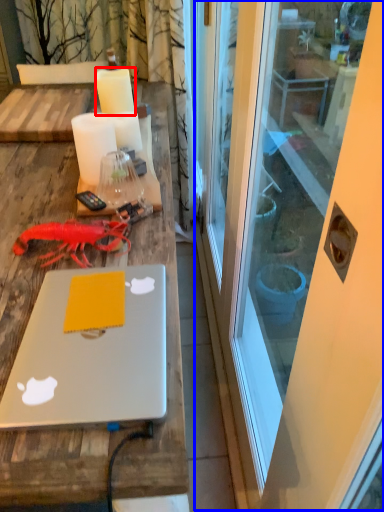
Question: Which object is further to the camera taking this photo, candle (highlighted by a red box) or screen door (highlighted by a blue box)?

Choices:
 (A) candle
 (B) screen door

Answer: (A)